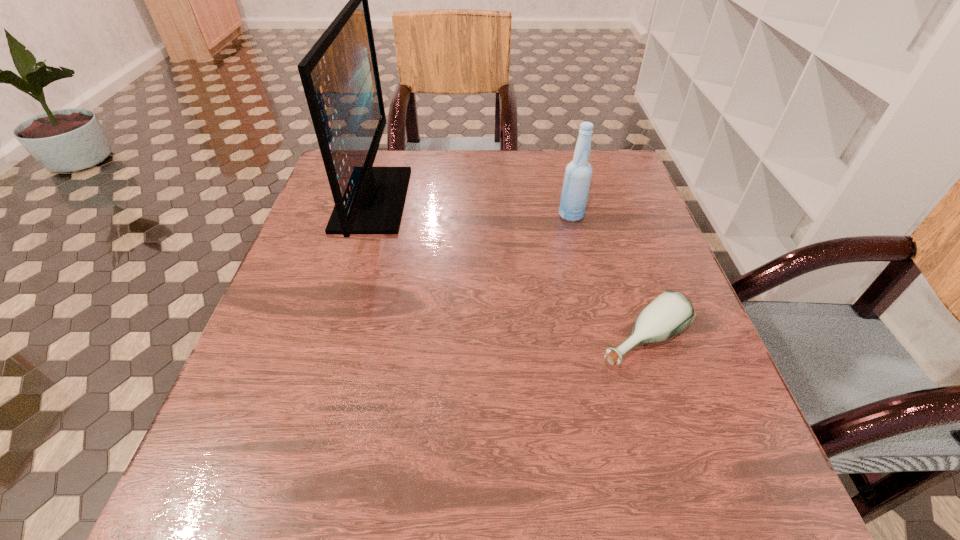
Locate an element on the screen. Image resolution: width=960 pixels, height=540 pixels. object positioned at the left edge is located at coordinates (340, 77).

Locate an element on the screen. The width and height of the screenshot is (960, 540). object located in the far left corner section of the desktop is located at coordinates (340, 77).

This screenshot has height=540, width=960. In the image, there is a desktop. What are the coordinates of `vacant space at the far edge` in the screenshot? It's located at (464, 191).

The image size is (960, 540). I want to click on vacant position at the near edge of the desktop, so click(479, 491).

Find the location of `blank space at the left edge`. blank space at the left edge is located at coordinates (329, 204).

Locate an element on the screen. The height and width of the screenshot is (540, 960). vacant space at the right edge of the desktop is located at coordinates (704, 400).

This screenshot has width=960, height=540. In order to click on free region at the far right corner of the desktop in this screenshot , I will do `click(612, 191)`.

At what (x,y) coordinates should I click in order to perform the action: click on vacant region between the second shortest object and the nearest object. Please return your answer as a coordinate pair (x, y). This screenshot has height=540, width=960. Looking at the image, I should click on (607, 278).

Identify the location of vacant point located between the shortest object and the leftmost object. The width and height of the screenshot is (960, 540). (507, 270).

At what (x,y) coordinates should I click in order to perform the action: click on free space between the nearest object and the second tallest object. Please return your answer as a coordinate pair (x, y). Image resolution: width=960 pixels, height=540 pixels. Looking at the image, I should click on (607, 278).